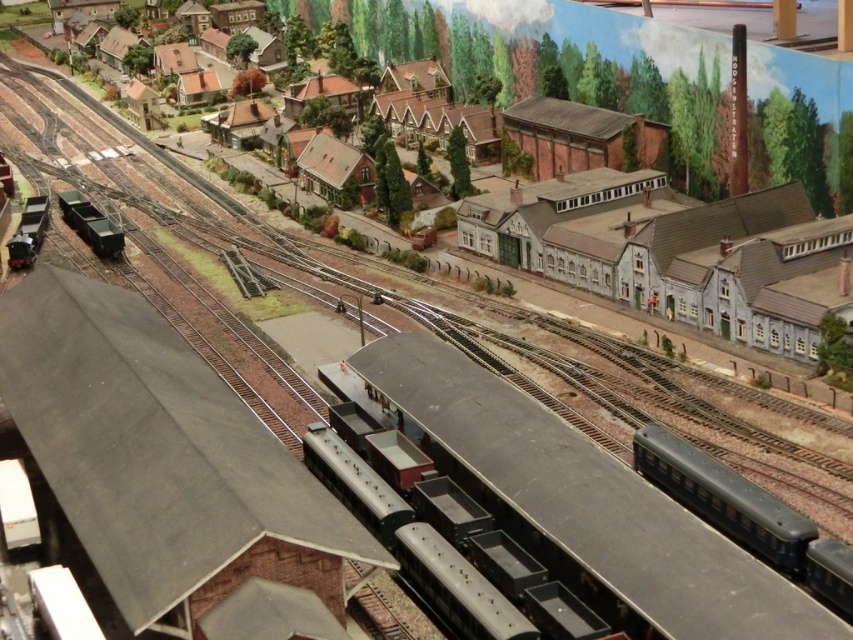
Is matte black train at center smaller than shiny black train at lower left?

No.

Who is higher up, matte black train at center or shiny black train at lower left?

Positioned higher is shiny black train at lower left.

Which is in front, point (511, 394) or point (21, 243)?

Point (511, 394) is more forward.

At what (x,y) coordinates should I click in order to perform the action: click on matte black train at center. Please return your answer as a coordinate pair (x, y). Image resolution: width=853 pixels, height=640 pixels. Looking at the image, I should click on (578, 502).

Is smooth gray roof at center below matte black train at center?

Actually, smooth gray roof at center is above matte black train at center.

Who is positioned more to the right, smooth gray roof at center or matte black train at center?

From the viewer's perspective, matte black train at center appears more on the right side.

I want to click on smooth gray roof at center, so click(152, 448).

Which is below, smooth gray roof at center or metallic green freight car at left?

Positioned lower is smooth gray roof at center.

Is point (96, 554) farther from camera compared to point (106, 230)?

No, it is not.

This screenshot has width=853, height=640. I want to click on smooth gray roof at center, so click(152, 448).